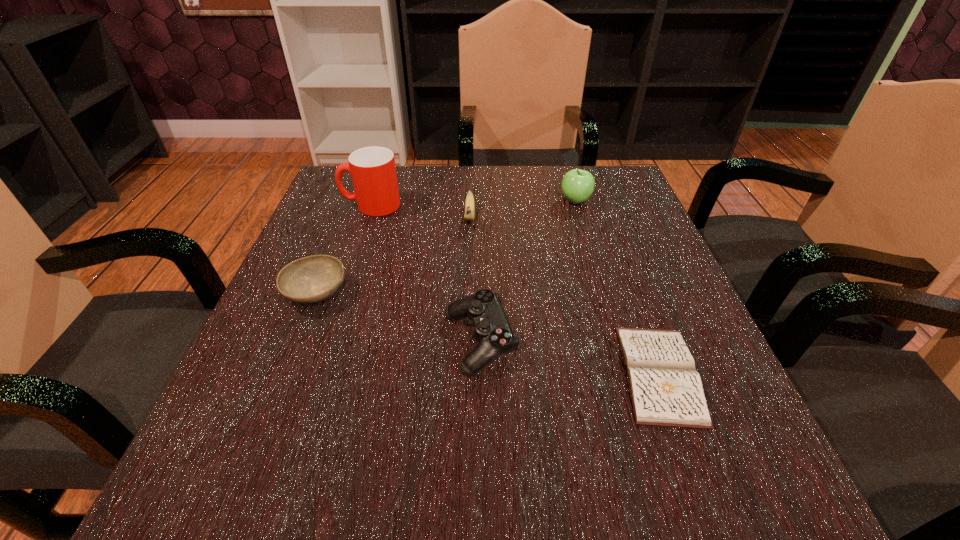
I want to click on free space located 0.140m on the left of the diary, so click(x=531, y=374).

Find the location of a particular element. This screenshot has width=960, height=540. cup that is at the far edge is located at coordinates (372, 169).

In order to click on apple at the far edge in this screenshot , I will do tap(577, 185).

Identify the location of banana that is at the far edge. The image size is (960, 540). (469, 214).

Locate an element on the screen. cup that is at the left edge is located at coordinates (372, 169).

This screenshot has height=540, width=960. In order to click on bowl located at the left edge in this screenshot , I will do `click(311, 279)`.

What are the coordinates of `apple located at the right edge` in the screenshot? It's located at (577, 185).

Identify the location of diary at the right edge. The width and height of the screenshot is (960, 540). (666, 390).

Locate an element on the screen. The width and height of the screenshot is (960, 540). object positioned at the far left corner is located at coordinates (372, 169).

Locate an element on the screen. The height and width of the screenshot is (540, 960). object present at the far right corner is located at coordinates (577, 185).